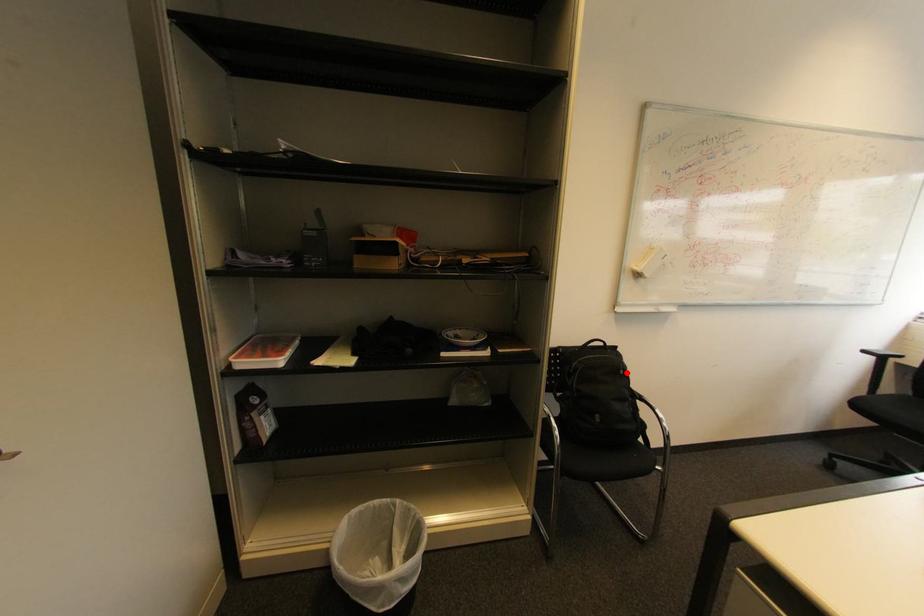
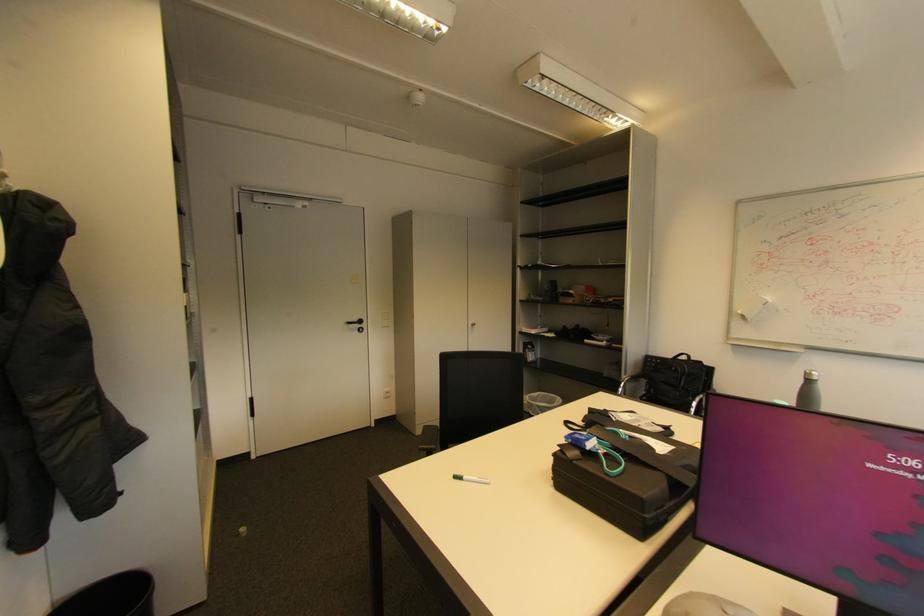
Where in the second image is the point corresponding to the highlighted location from the first image?

(678, 369)